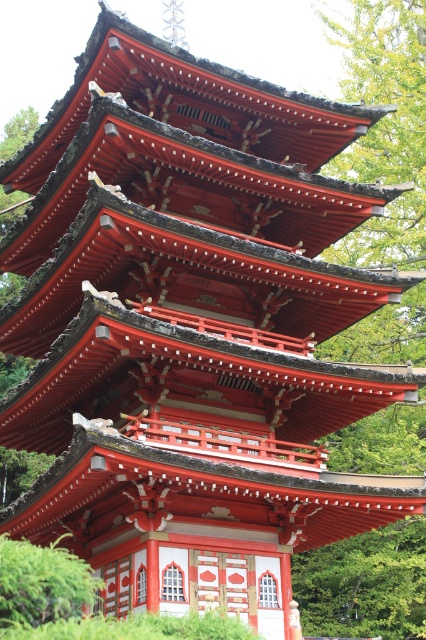
You are standing in front of the Japanese pagoda and want to place a small statue between the green leafy tree at upper center and the green leafy bush at lower left. Where should you position the statue to ensure it is between both plants?

The statue should be placed between the green leafy tree at upper center and the green leafy bush at lower left, positioned below the tree and above the bush since the tree is above the bush.

You are standing in front of the traditional Japanese pagoda and want to take a photo. You notice two points on the pagoda marked as point 1 at coordinates (x=353, y=172) and point 2 at (x=62, y=593). Which point is closer to your camera lens when taking the photo?

Point 1 at coordinates (x=353, y=172) is closer to the camera lens because it is further to the camera than point 2 at (x=62, y=593).